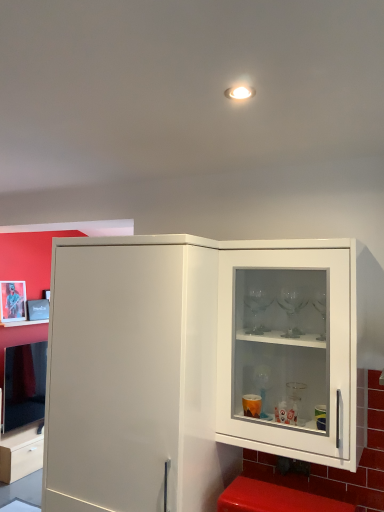
Question: Is metallic silver picture frame at upper left situated inside white glossy cabinet at right or outside?

Choices:
 (A) outside
 (B) inside

Answer: (A)

Question: Considering the relative positions of metallic silver picture frame at upper left and white glossy cabinet at right in the image provided, is metallic silver picture frame at upper left to the left or to the right of white glossy cabinet at right?

Choices:
 (A) left
 (B) right

Answer: (A)

Question: Which object is the farthest from the metallic silver picture frame at upper left?

Choices:
 (A) white glossy cabinet at right
 (B) white glossy cabinet door at center
 (C) red plastic step stool at lower right

Answer: (C)

Question: Which object is the farthest from the red plastic step stool at lower right?

Choices:
 (A) metallic silver picture frame at upper left
 (B) white glossy cabinet at right
 (C) white glossy cabinet door at center

Answer: (A)